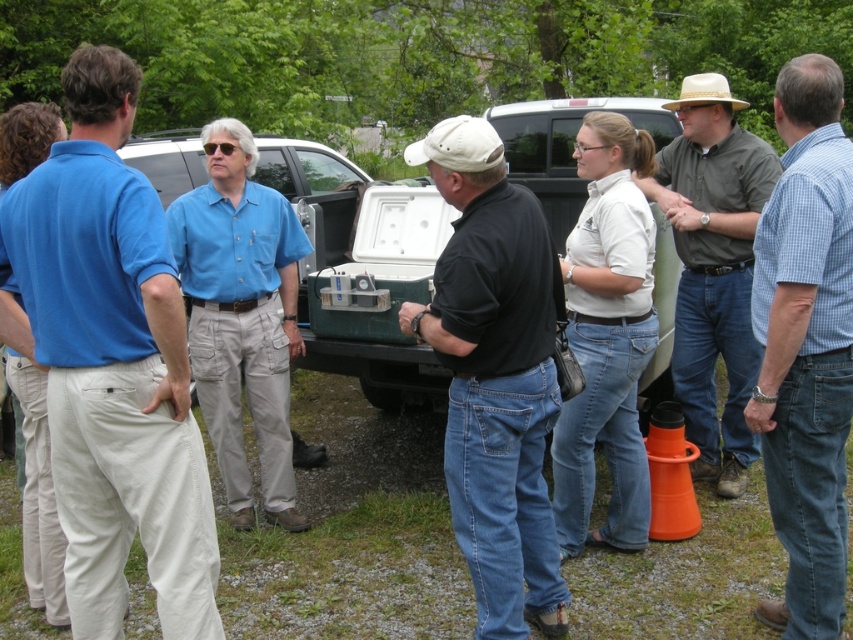
Is matte brown shirt at center in front of matte blue truck at center?

Yes, matte brown shirt at center is closer to the viewer.

Which is more to the right, matte brown shirt at center or matte blue truck at center?

From the viewer's perspective, matte brown shirt at center appears more on the right side.

The image size is (853, 640). In order to click on matte brown shirt at center in this screenshot , I will do `click(712, 268)`.

From the picture: Is matte blue shirt at center to the left of matte blue truck at center from the viewer's perspective?

Correct, you'll find matte blue shirt at center to the left of matte blue truck at center.

Is the position of matte blue shirt at center less distant than that of matte blue truck at center?

That is True.

The width and height of the screenshot is (853, 640). Find the location of `matte blue shirt at center`. matte blue shirt at center is located at coordinates [x=241, y=316].

At what (x,y) coordinates should I click in order to perform the action: click on matte blue shirt at center. Please return your answer as a coordinate pair (x, y). The width and height of the screenshot is (853, 640). Looking at the image, I should click on (241, 316).

How much distance is there between blue checkered shirt at right and beige straw hat at upper right?

The distance of blue checkered shirt at right from beige straw hat at upper right is 5.79 feet.

Does blue checkered shirt at right appear on the right side of beige straw hat at upper right?

In fact, blue checkered shirt at right is to the left of beige straw hat at upper right.

Is point (844, 276) less distant than point (730, 102)?

Yes.

You are a GUI agent. You are given a task and a screenshot of the screen. Output one action in this format:
    pyautogui.click(x=<x>, y=<y>)
    Task: Click on the blue checkered shirt at right
    
    Given the screenshot: What is the action you would take?
    pyautogui.click(x=805, y=346)